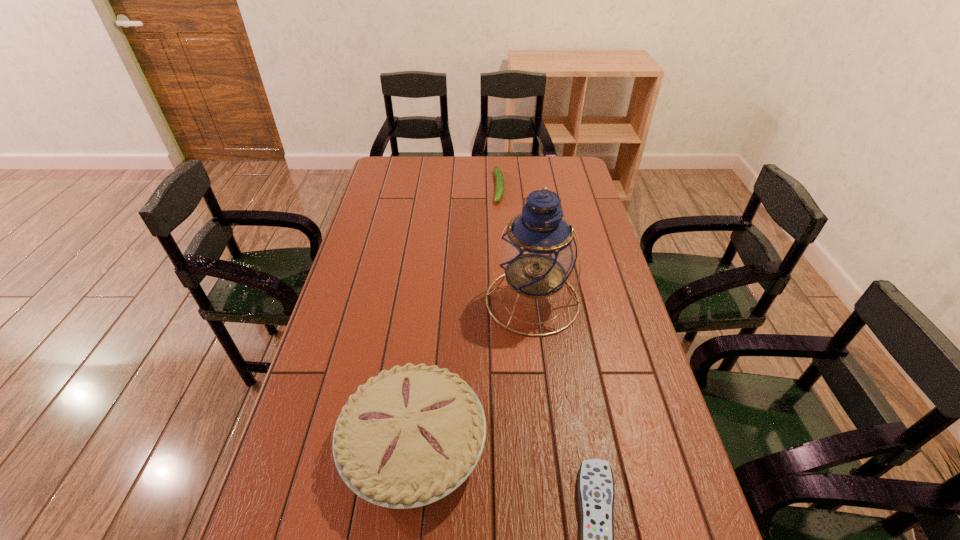
Locate an element on the screen. vacant space at the right edge of the desktop is located at coordinates (584, 191).

At what (x,y) coordinates should I click in order to perform the action: click on free space at the far left corner of the desktop. Please return your answer as a coordinate pair (x, y). Looking at the image, I should click on (406, 175).

In the image, there is a desktop. Where is `free space at the far right corner`? This screenshot has height=540, width=960. free space at the far right corner is located at coordinates (564, 160).

You are a GUI agent. You are given a task and a screenshot of the screen. Output one action in this format:
    pyautogui.click(x=<x>, y=<y>)
    Task: Click on the vacant space at the near right corner of the desktop
    This screenshot has width=960, height=540.
    Given the screenshot: What is the action you would take?
    pyautogui.click(x=689, y=515)

Locate an element on the screen. This screenshot has height=540, width=960. vacant area between the lantern and the second tallest object is located at coordinates (473, 373).

Locate an element on the screen. This screenshot has height=540, width=960. vacant area between the lantern and the third shortest object is located at coordinates (473, 373).

Locate which object is the closest to the remote control. Please provide its 2D coordinates. Your answer should be formatted as a tuple, i.e. [(x, y)], where the tuple contains the x and y coordinates of a point satisfying the conditions above.

[(410, 436)]

Locate which object ranks third in proximity to the second shortest object. Please provide its 2D coordinates. Your answer should be formatted as a tuple, i.e. [(x, y)], where the tuple contains the x and y coordinates of a point satisfying the conditions above.

[(595, 488)]

You are a GUI agent. You are given a task and a screenshot of the screen. Output one action in this format:
    pyautogui.click(x=<x>, y=<y>)
    Task: Click on the free location that satisfies the following two spatial constraints: 1. on the front side of the farthest object; 2. on the left side of the lantern
    
    Given the screenshot: What is the action you would take?
    pyautogui.click(x=506, y=301)